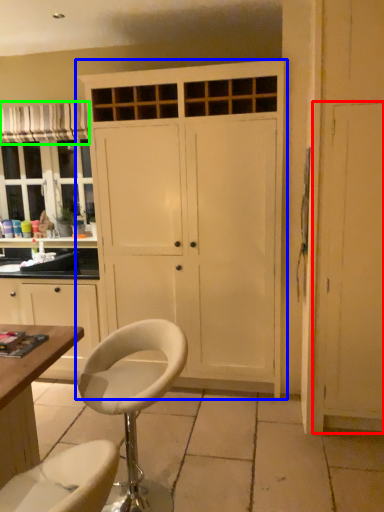
Question: Considering the real-world distances, which object is closest to screen door (highlighted by a red box)? cupboard (highlighted by a blue box) or curtain (highlighted by a green box).

Choices:
 (A) cupboard
 (B) curtain

Answer: (A)